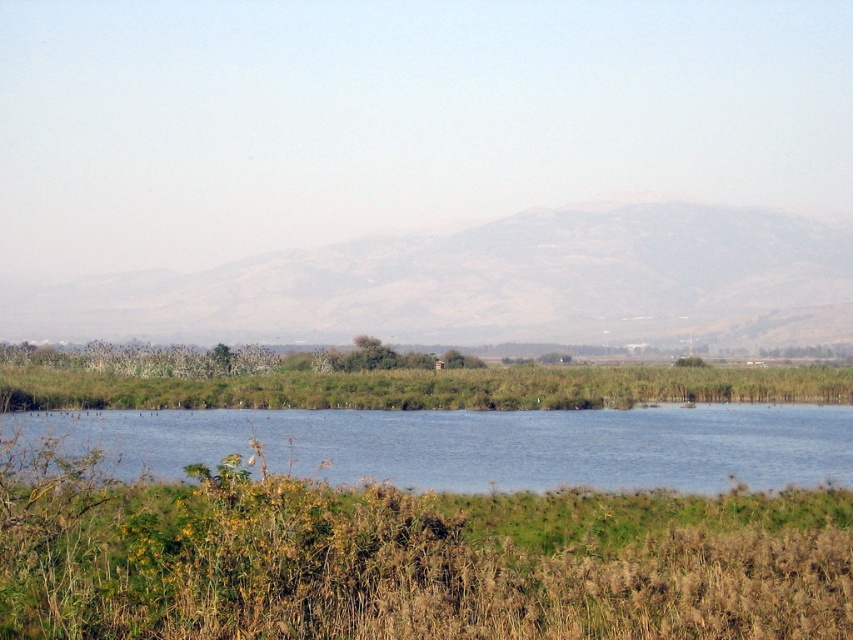
Question: Which point appears closest to the camera in this image?

Choices:
 (A) (820, 403)
 (B) (730, 216)
 (C) (639, 413)

Answer: (C)

Question: Can you confirm if blue water at center is thinner than green grassy reeds at center?

Choices:
 (A) no
 (B) yes

Answer: (B)

Question: Estimate the real-world distances between objects in this image. Which object is closer to the blue water at center?

Choices:
 (A) gray textured mountain at center
 (B) green grassy reeds at center

Answer: (B)

Question: From the image, what is the correct spatial relationship of gray textured mountain at center in relation to green grassy reeds at center?

Choices:
 (A) above
 (B) below

Answer: (A)

Question: Is gray textured mountain at center below blue water at center?

Choices:
 (A) yes
 (B) no

Answer: (B)

Question: Estimate the real-world distances between objects in this image. Which object is farther from the gray textured mountain at center?

Choices:
 (A) green grassy reeds at center
 (B) blue water at center

Answer: (B)